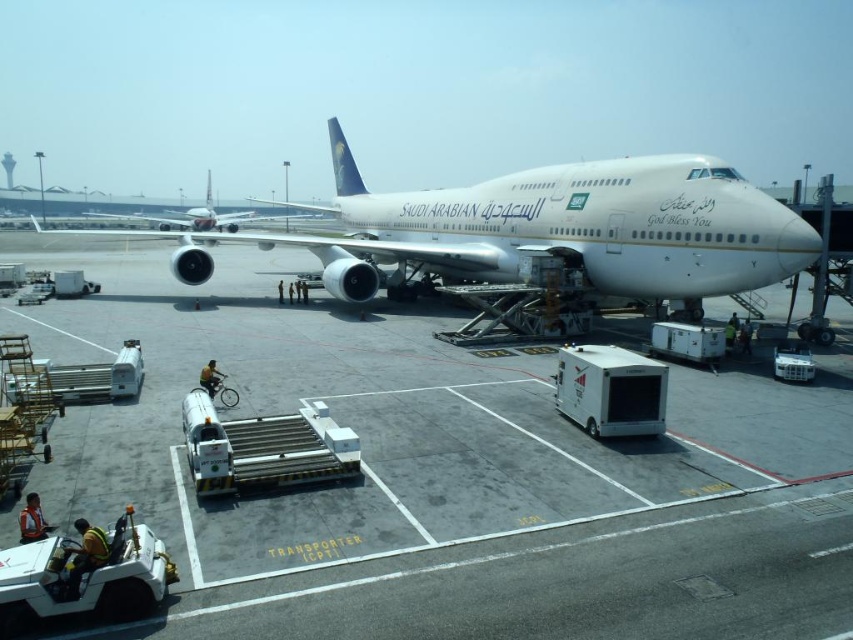
Question: Which point is closer to the camera taking this photo?

Choices:
 (A) (387, 616)
 (B) (354, 204)

Answer: (A)

Question: Which object is farther from the camera taking this photo?

Choices:
 (A) white metallic airplane at center
 (B) white glossy tarmac at center

Answer: (A)

Question: Which point is closer to the camera taking this photo?

Choices:
 (A) (784, 244)
 (B) (253, 593)

Answer: (B)

Question: Is white glossy tarmac at center smaller than white metallic airplane at center?

Choices:
 (A) no
 (B) yes

Answer: (B)

Question: Does white glossy tarmac at center appear over white metallic airplane at center?

Choices:
 (A) yes
 (B) no

Answer: (B)

Question: Can you confirm if white glossy tarmac at center is positioned to the left of white metallic airplane at center?

Choices:
 (A) no
 (B) yes

Answer: (A)